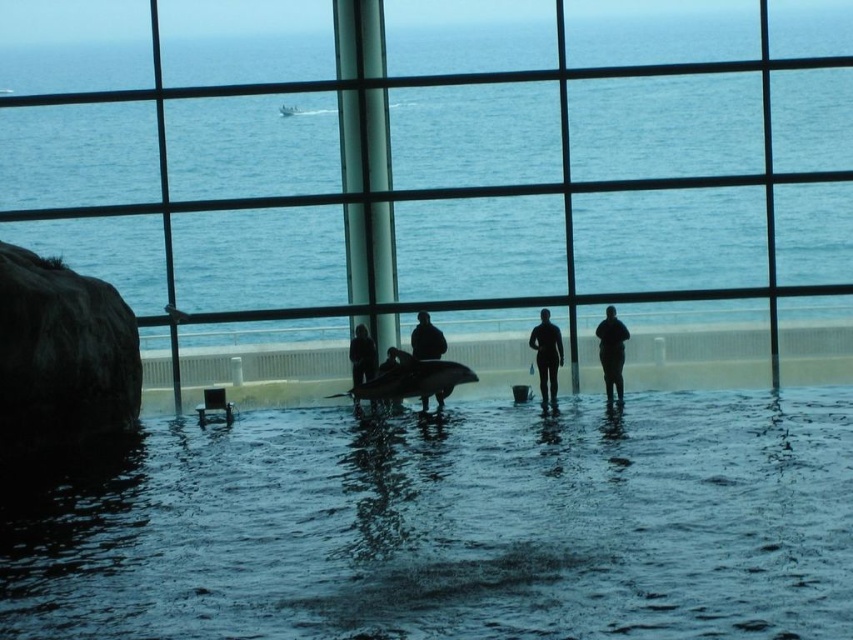
You are an architect designing a new building and want to ensure that the transparent glass window at center provides a clear view of the exterior while also accommodating the silhouette rubber suit at center. Given their size difference, which object should be placed closer to the window to maintain visibility?

The silhouette rubber suit at center should be placed closer to the transparent glass window at center since it is smaller in size, allowing it to be positioned near the window without obstructing the view. The transparent glass window at center, being larger, can remain in its central position to ensure an unobstructed view of the exterior.

You are a visitor standing in the indoor pool area and want to take a photo through the transparent glass window at center to capture both the silhouette wetsuit at center and the distant boat outside. Can the window accommodate both objects in the frame?

The transparent glass window at center is larger in size than the silhouette wetsuit at center, so yes, the window can accommodate both the silhouette wetsuit at center and the distant boat outside in the frame.